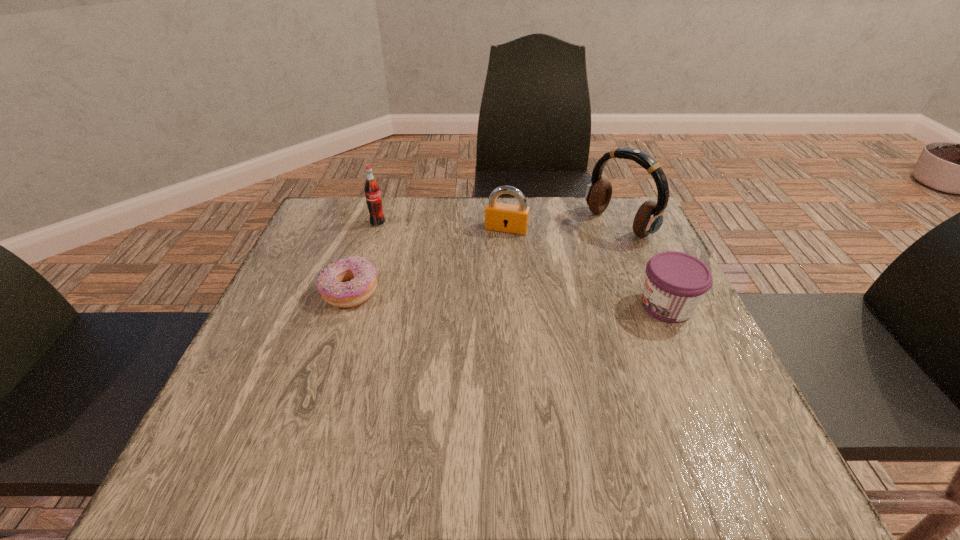
The image size is (960, 540). In order to click on the shortest object in this screenshot , I will do `click(350, 281)`.

The image size is (960, 540). In order to click on the fourth tallest object in this screenshot , I will do (x=675, y=282).

The height and width of the screenshot is (540, 960). Identify the location of soda bottle. (372, 190).

Image resolution: width=960 pixels, height=540 pixels. Find the location of `the third object from right to left`. the third object from right to left is located at coordinates (502, 217).

Locate an element on the screen. This screenshot has height=540, width=960. the third tallest object is located at coordinates pyautogui.click(x=502, y=217).

Locate an element on the screen. The width and height of the screenshot is (960, 540). the tallest object is located at coordinates (649, 218).

Locate an element on the screen. vacant space located 0.210m on the back of the doughnut is located at coordinates (372, 222).

At what (x,y) coordinates should I click in order to perform the action: click on free space located on the front label of the fourth tallest object. Please return your answer as a coordinate pair (x, y). Image resolution: width=960 pixels, height=540 pixels. Looking at the image, I should click on (505, 306).

Where is `vacant space situated on the front label of the fourth tallest object`? The image size is (960, 540). vacant space situated on the front label of the fourth tallest object is located at coordinates tap(472, 306).

Identify the location of vacant space located on the front label of the fourth tallest object. (482, 306).